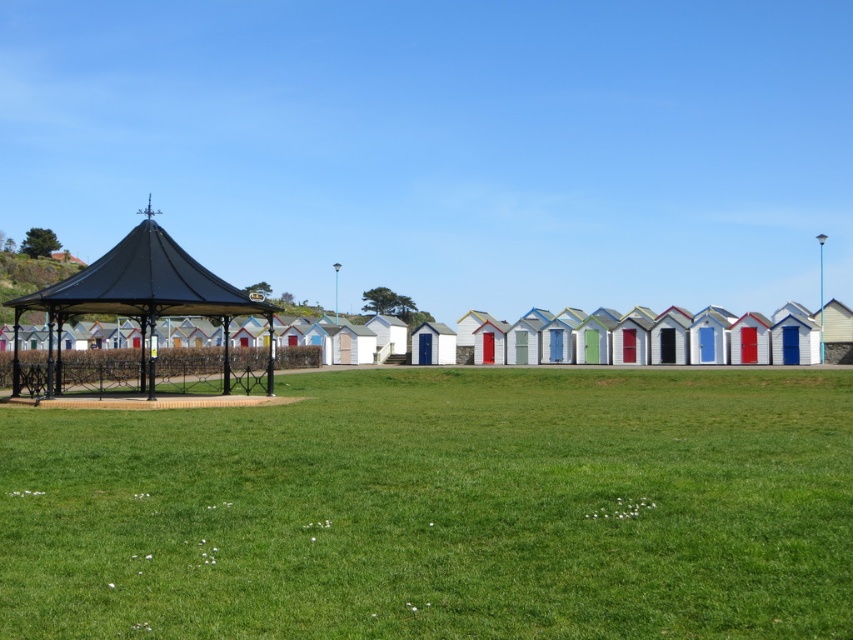
Question: Is green grass at center wider than black metal gazebo at left?

Choices:
 (A) no
 (B) yes

Answer: (A)

Question: Is green grass at center above black metal gazebo at left?

Choices:
 (A) no
 (B) yes

Answer: (A)

Question: Can you confirm if green grass at center is wider than black metal gazebo at left?

Choices:
 (A) yes
 (B) no

Answer: (B)